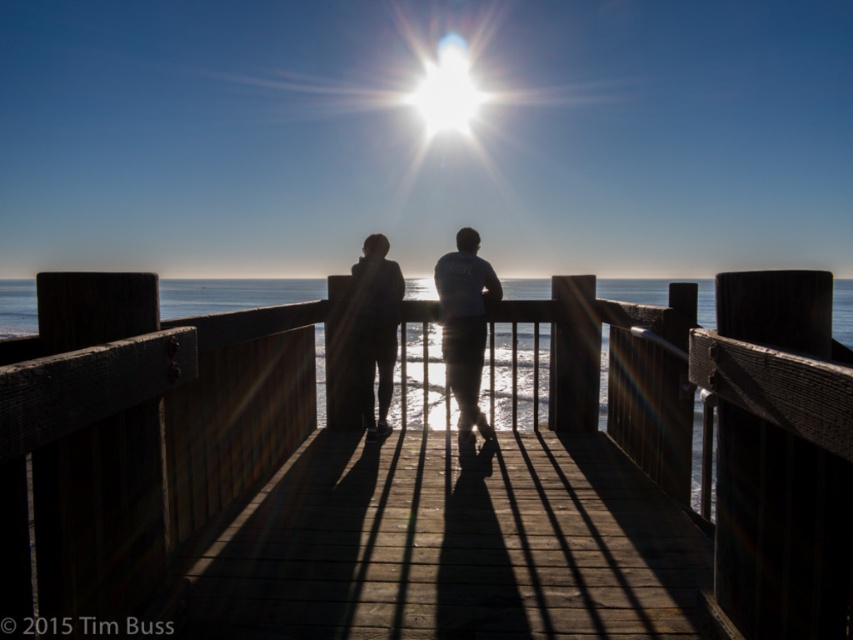
You are a photographer planning to take a photo of the two silhouetted individuals at the pier. The camera is positioned such that the point at coordinates point (465,324) is at the center of the frame. Which object from the scene will be centered in your photo?

The point at coordinates point (465,324) indicates the silhouette clothing at center, so the silhouette clothing at center will be centered in the photo.

You are a photographer trying to capture the two people at the center of the image. Which of the two, the silhouette clothing at center or the white cotton shirt at center, would appear larger in your photo?

The white cotton shirt at center would appear larger in the photo because it is larger than the silhouette clothing at center.

You are a photographer trying to capture a closeup shot of the silhouette clothing at center and the white cotton shirt at center. Can you fit both into the frame of your camera which has a maximum width of 0.6 inches?

The silhouette clothing at center and white cotton shirt at center are 0.58 inches apart, so yes, both can fit into the camera frame since the distance between them is less than the maximum width of 0.6 inches.